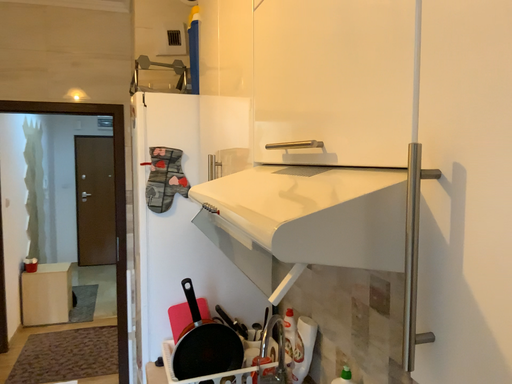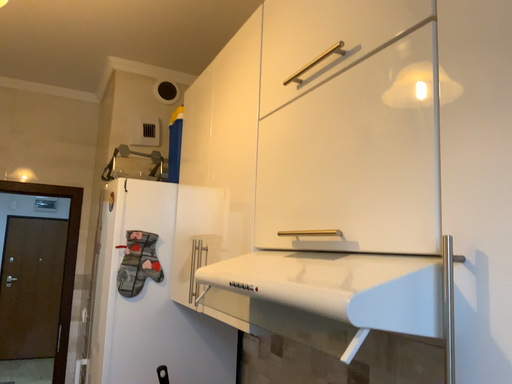
Question: How did the camera likely rotate when shooting the video?

Choices:
 (A) rotated left
 (B) rotated right

Answer: (B)